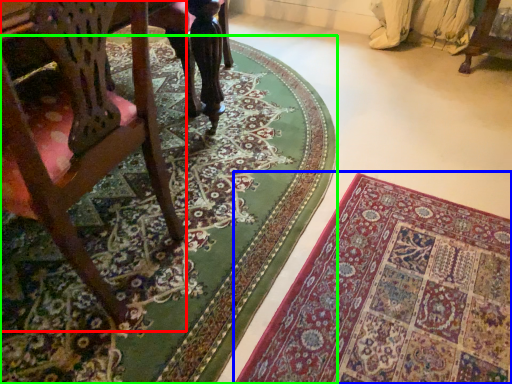
Question: Which is nearer to the chair (highlighted by a red box)? mat (highlighted by a blue box) or mat (highlighted by a green box).

Choices:
 (A) mat
 (B) mat

Answer: (B)